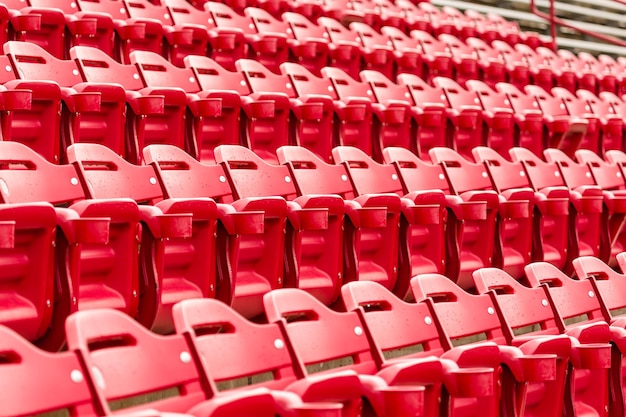
Locate an element on the screen. chairs in front row is located at coordinates (52, 388), (141, 375), (239, 348), (337, 341), (385, 329), (464, 323), (508, 308), (563, 300), (613, 293), (623, 266).